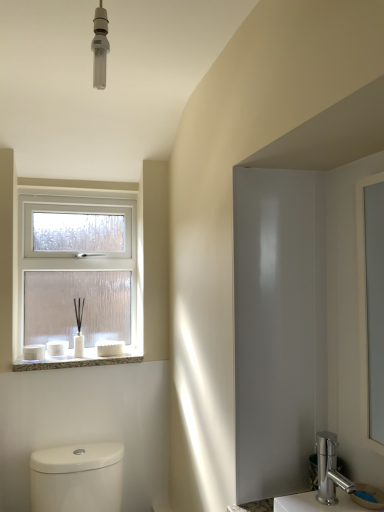
Question: Considering the relative sizes of clear glass window at upper left and white glossy toilet at lower left in the image provided, is clear glass window at upper left taller than white glossy toilet at lower left?

Choices:
 (A) yes
 (B) no

Answer: (A)

Question: Does clear glass window at upper left have a greater width compared to white glossy toilet at lower left?

Choices:
 (A) yes
 (B) no

Answer: (B)

Question: Is clear glass window at upper left thinner than white glossy toilet at lower left?

Choices:
 (A) no
 (B) yes

Answer: (B)

Question: Is clear glass window at upper left not close to white glossy toilet at lower left?

Choices:
 (A) yes
 (B) no

Answer: (B)

Question: Is clear glass window at upper left at the right side of white glossy toilet at lower left?

Choices:
 (A) no
 (B) yes

Answer: (A)

Question: Considering the positions of chrome metallic faucet at lower right and white textured stone at lower left in the image, is chrome metallic faucet at lower right bigger or smaller than white textured stone at lower left?

Choices:
 (A) small
 (B) big

Answer: (A)

Question: From a real-world perspective, is chrome metallic faucet at lower right physically located above or below white textured stone at lower left?

Choices:
 (A) above
 (B) below

Answer: (B)

Question: Is chrome metallic faucet at lower right in front of or behind white textured stone at lower left in the image?

Choices:
 (A) behind
 (B) front

Answer: (B)

Question: In the image, is chrome metallic faucet at lower right on the left side or the right side of white textured stone at lower left?

Choices:
 (A) right
 (B) left

Answer: (A)

Question: From a real-world perspective, is white textured stone at lower left above or below polished silver faucet at lower right?

Choices:
 (A) below
 (B) above

Answer: (B)

Question: Considering the positions of white textured stone at lower left and polished silver faucet at lower right in the image, is white textured stone at lower left wider or thinner than polished silver faucet at lower right?

Choices:
 (A) thin
 (B) wide

Answer: (B)

Question: In terms of size, does white textured stone at lower left appear bigger or smaller than polished silver faucet at lower right?

Choices:
 (A) small
 (B) big

Answer: (B)

Question: Based on their positions, is white textured stone at lower left located to the left or right of polished silver faucet at lower right?

Choices:
 (A) right
 (B) left

Answer: (B)

Question: Considering the positions of white textured stone at lower left and clear glass window at upper left in the image, is white textured stone at lower left bigger or smaller than clear glass window at upper left?

Choices:
 (A) small
 (B) big

Answer: (A)

Question: In terms of width, does white textured stone at lower left look wider or thinner when compared to clear glass window at upper left?

Choices:
 (A) wide
 (B) thin

Answer: (A)